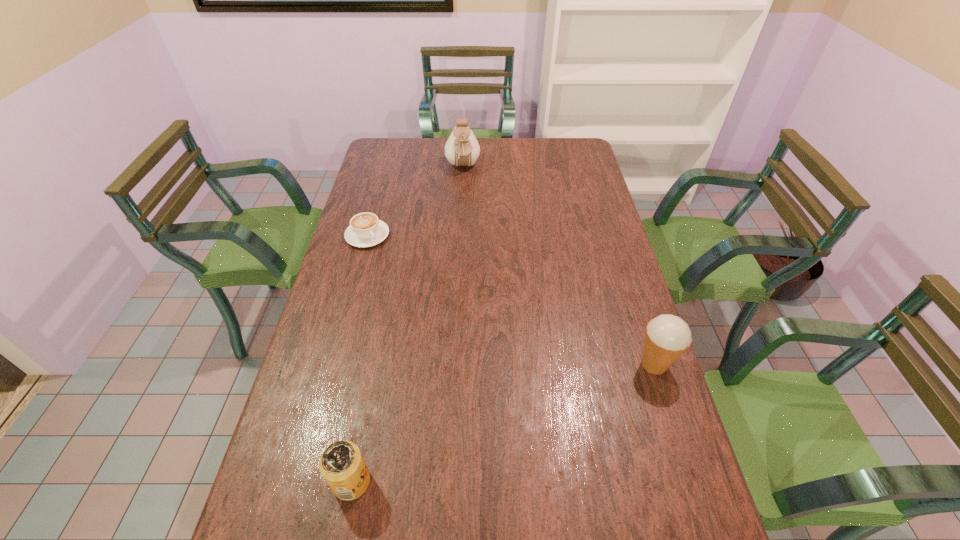
At what (x,y) coordinates should I click in order to perform the action: click on free region that satisfies the following two spatial constraints: 1. on the back side of the beer can; 2. on the right side of the rightmost object. Please return your answer as a coordinate pair (x, y). Looking at the image, I should click on (374, 364).